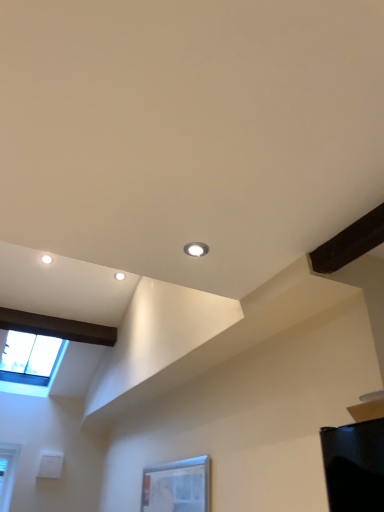
Question: Can you confirm if matte white droplight at upper center is shorter than transparent glass window at lower center, placed as the first window when sorted from right to left?

Choices:
 (A) yes
 (B) no

Answer: (A)

Question: Is matte white droplight at upper center at the left side of transparent glass window at lower center, placed as the first window when sorted from right to left?

Choices:
 (A) no
 (B) yes

Answer: (A)

Question: From a real-world perspective, is matte white droplight at upper center located beneath transparent glass window at lower center, which is the 1th window in front-to-back order?

Choices:
 (A) yes
 (B) no

Answer: (B)

Question: Considering the relative positions of matte white droplight at upper center and transparent glass window at lower center, placed as the first window when sorted from right to left, in the image provided, is matte white droplight at upper center in front of transparent glass window at lower center, placed as the first window when sorted from right to left,?

Choices:
 (A) no
 (B) yes

Answer: (B)

Question: Could you tell me if matte white droplight at upper center is facing transparent glass window at lower center, placed as the first window when sorted from right to left?

Choices:
 (A) yes
 (B) no

Answer: (B)

Question: In the image, is matte white droplight at upper center on the left side or the right side of transparent glass window at lower center, placed as the first window when sorted from right to left?

Choices:
 (A) left
 (B) right

Answer: (B)

Question: From their relative heights in the image, would you say matte white droplight at upper center is taller or shorter than transparent glass window at lower center, which is the 1th window in front-to-back order?

Choices:
 (A) short
 (B) tall

Answer: (A)

Question: Considering the positions of matte white droplight at upper center and transparent glass window at lower center, which is the 1th window in front-to-back order, in the image, is matte white droplight at upper center wider or thinner than transparent glass window at lower center, which is the 1th window in front-to-back order,?

Choices:
 (A) wide
 (B) thin

Answer: (A)

Question: Is point (195, 243) positioned closer to the camera than point (157, 509)?

Choices:
 (A) farther
 (B) closer

Answer: (B)

Question: Is transparent glass window at upper left, placed as the 1th window when sorted from back to front, inside the boundaries of matte white droplight at upper center, or outside?

Choices:
 (A) inside
 (B) outside

Answer: (B)

Question: Is transparent glass window at upper left, which appears as the 2th window when viewed from the front, wider or thinner than matte white droplight at upper center?

Choices:
 (A) thin
 (B) wide

Answer: (B)

Question: Does point tap(41, 345) appear closer or farther from the camera than point tap(193, 248)?

Choices:
 (A) farther
 (B) closer

Answer: (A)

Question: Considering the relative positions of transparent glass window at upper left, placed as the 1th window when sorted from back to front, and matte white droplight at upper center in the image provided, is transparent glass window at upper left, placed as the 1th window when sorted from back to front, to the left or to the right of matte white droplight at upper center?

Choices:
 (A) right
 (B) left

Answer: (B)

Question: Is transparent glass window at upper left, the 1th window from the left, to the left or to the right of transparent glass window at lower center, the second window when ordered from back to front, in the image?

Choices:
 (A) left
 (B) right

Answer: (A)

Question: Looking at the image, does transparent glass window at upper left, which appears as the 2th window when viewed from the front, seem bigger or smaller compared to transparent glass window at lower center, the second window when ordered from back to front?

Choices:
 (A) big
 (B) small

Answer: (A)